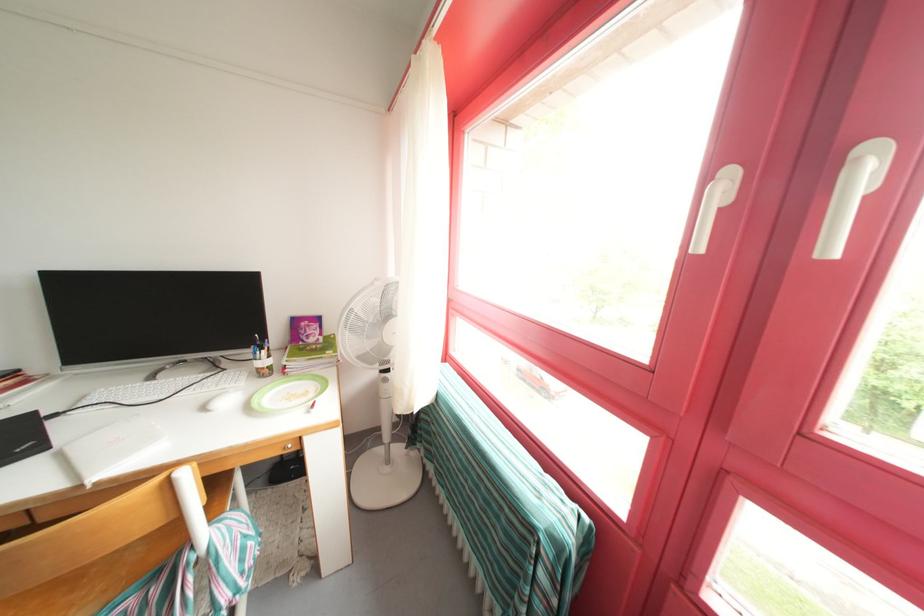
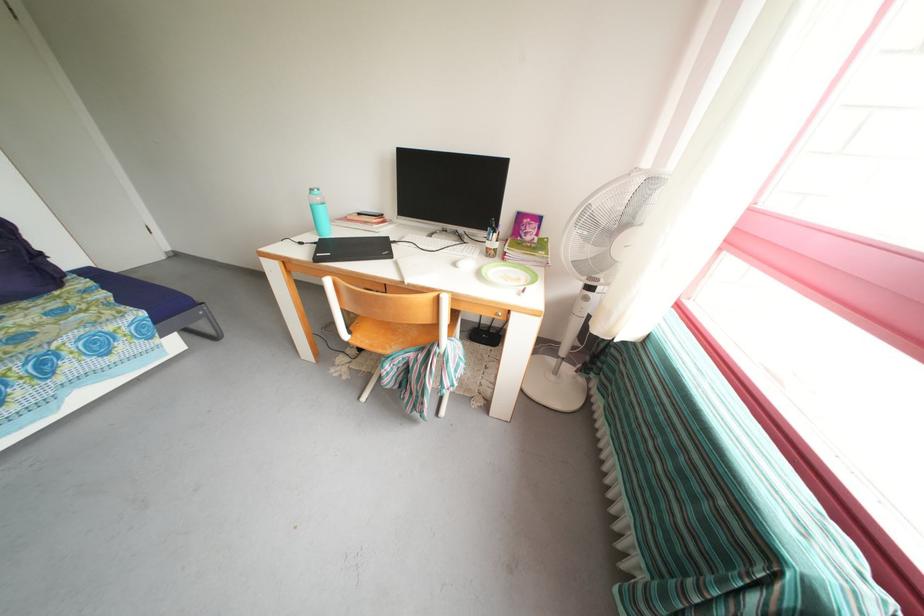
In the second image, find the point that corresponds to [314,342] in the first image.

(532, 238)